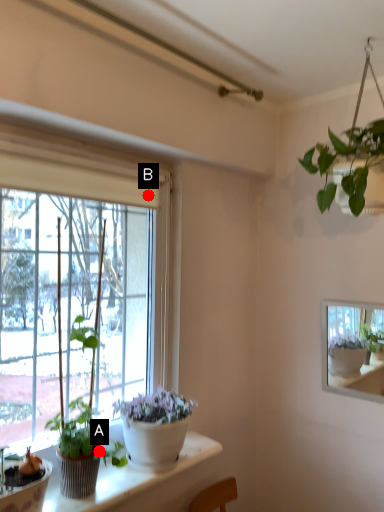
Question: Two points are circled on the image, labeled by A and B beside each circle. Among these points, which one is farthest from the camera?

Choices:
 (A) A is further
 (B) B is further

Answer: (B)